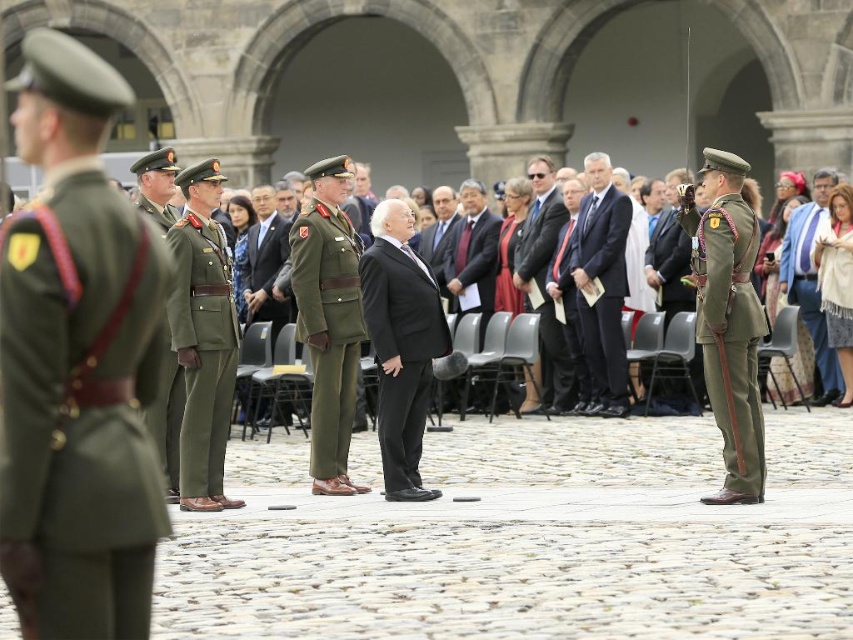
You are standing at the position of the soldiers in olive green uniforms with red accents. You want to shake hands with the man in the matte black suit at center. How many steps would you need to take to reach him?

The distance between the soldiers in olive green uniforms with red accents and the matte black suit at center is 209.97 feet. Assuming an average step length of about 2.5 feet, you would need approximately 84 steps to reach the matte black suit at center.

You are a guest at this ceremony and need to find your seat. The entrance is located at point (547, 177) and your seat is at point (456, 260). Since you can only move forward in a straight line, will you be able to walk from the entrance to your seat without changing direction?

Point (547, 177) is in front of point (456, 260), so if you move forward in a straight line from the entrance at point (547, 177), you will not be able to reach your seat at point (456, 260) without changing direction because your seat is behind you relative to your facing direction.